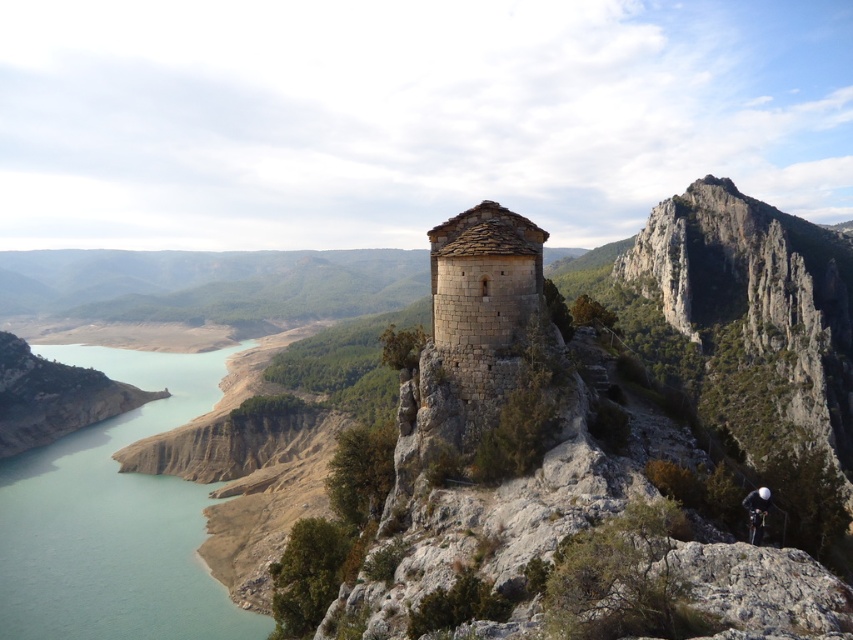
You are a hiker who has just arrived at this ancient stone tower. You notice the turquoise water at lower left and the black fabric helmet at center. Which object is bigger in size?

The turquoise water at lower left is larger in size than the black fabric helmet at center.

You are standing at point (480, 232) and want to reach the ancient stone tower. There is a point at (169, 355) which is behind you. Can you walk directly towards the tower from your current position without passing through the point behind you?

Point (169, 355) is behind point (480, 232). Since you are at point (480, 232) and the tower is your destination, the point behind you does not block your path. You can walk directly towards the tower without passing through the point behind you.